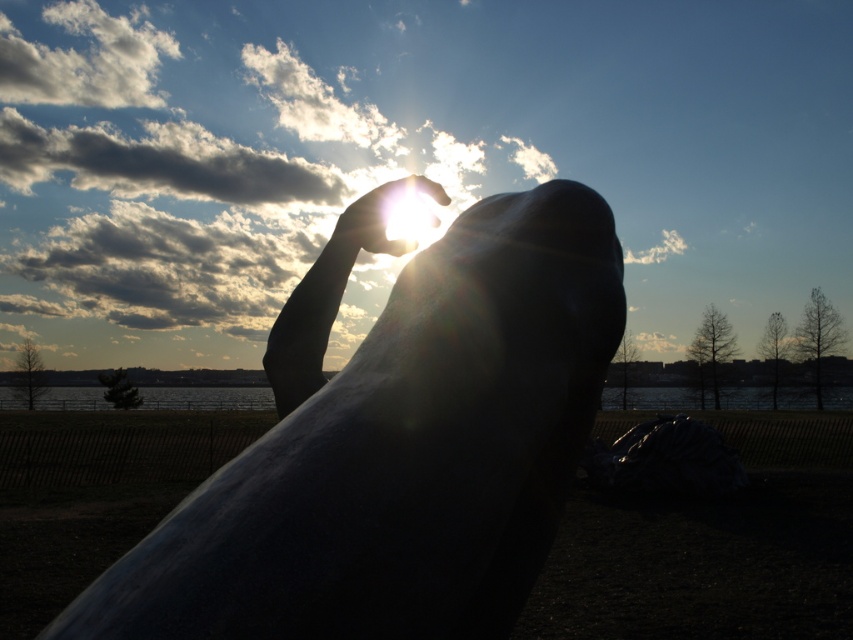
Can you confirm if satin silver statue at center is positioned above translucent glass hand at upper center?

No, satin silver statue at center is not above translucent glass hand at upper center.

Is point (379, 625) in front of point (386, 204)?

Yes, point (379, 625) is closer to viewer.

Where is `satin silver statue at center`? satin silver statue at center is located at coordinates (396, 448).

Where is `satin silver statue at center`? satin silver statue at center is located at coordinates (396, 448).